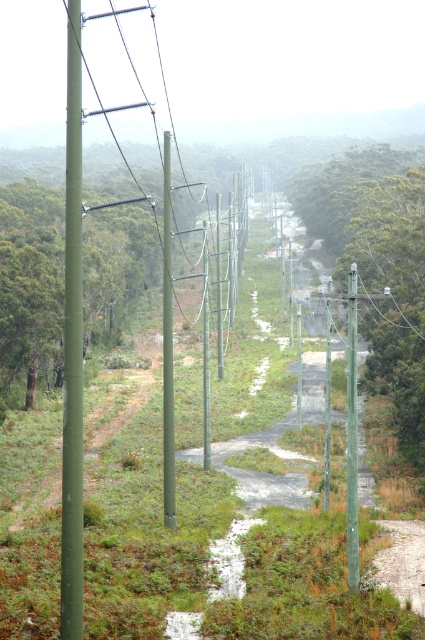
You are a hiker standing on the narrow road and see the green matte pole at left and the green painted wood telegraph pole at center. Which pole is closer to you?

The green matte pole at left is closer to you because it is positioned over the green painted wood telegraph pole at center, indicating it is in front.

You are a maintenance worker inspecting the utility poles along the road. You notice two poles, the green textured pole at center and the green matte pole at left. Which pole should you prioritize checking if the bigger pole is more prone to structural issues?

The green textured pole at center should be prioritized because it is bigger than the green matte pole at left, and larger poles may have higher structural risks.

You are a delivery driver navigating a narrow, winding rural road with two utility poles in view. You need to pass between the green matte pole at left and the green painted wood telegraph pole at center. Can you safely navigate through the space between them?

The green matte pole at left is positioned to the left of the green painted wood telegraph pole at center, so the space between them is part of the road which is narrow but navigable for a vehicle. Since the road is designed for passage, you can safely navigate through the space between them.